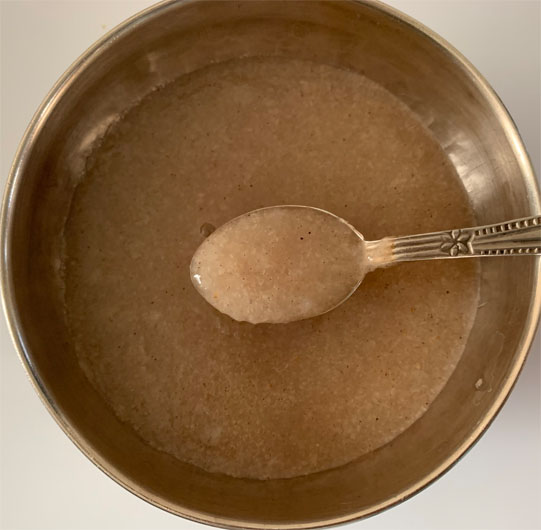
What are the coordinates of `shadow from bowl` in the screenshot? It's located at (525, 377).